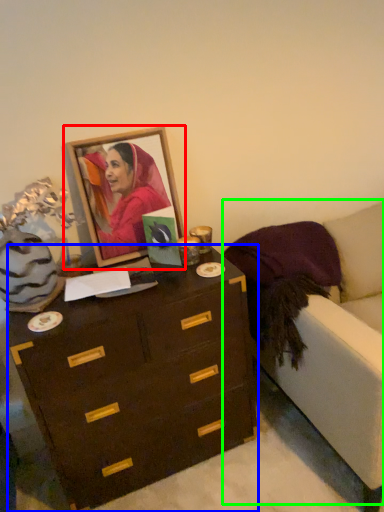
Question: Which object is the farthest from picture frame (highlighted by a red box)? Choose among these: chest of drawers (highlighted by a blue box) or armchair (highlighted by a green box).

Choices:
 (A) chest of drawers
 (B) armchair

Answer: (B)